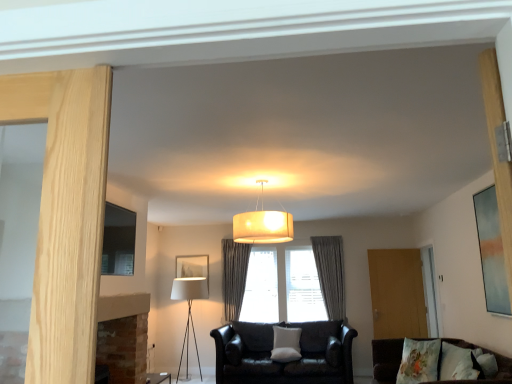
Question: Is white fabric pillow at center, the first pillow when ordered from bottom to top, facing towards gray fabric curtain at center, marked as the first curtain in a left-to-right arrangement?

Choices:
 (A) no
 (B) yes

Answer: (A)

Question: Is white fabric pillow at center, the first pillow when ordered from bottom to top, smaller than gray fabric curtain at center, marked as the first curtain in a left-to-right arrangement?

Choices:
 (A) no
 (B) yes

Answer: (B)

Question: From a real-world perspective, is white fabric pillow at center, the first pillow positioned from the left, over gray fabric curtain at center, which is counted as the 2th curtain, starting from the right?

Choices:
 (A) no
 (B) yes

Answer: (A)

Question: Is white fabric pillow at center, which appears as the 3th pillow when viewed from the right, shorter than gray fabric curtain at center, which is counted as the 2th curtain, starting from the right?

Choices:
 (A) no
 (B) yes

Answer: (B)

Question: Considering the relative positions of white fabric pillow at center, the 3th pillow in the top-to-bottom sequence, and gray fabric curtain at center, marked as the first curtain in a left-to-right arrangement, in the image provided, is white fabric pillow at center, the 3th pillow in the top-to-bottom sequence, to the left of gray fabric curtain at center, marked as the first curtain in a left-to-right arrangement, from the viewer's perspective?

Choices:
 (A) no
 (B) yes

Answer: (A)

Question: From the image's perspective, is white fabric pillow at center, the first pillow when ordered from back to front, beneath gray fabric curtain at center, which is counted as the 2th curtain, starting from the right?

Choices:
 (A) no
 (B) yes

Answer: (B)

Question: Is matte black picture frame at left, the first picture frame in the left-to-right sequence, surrounding velvet brown couch at lower right, the first studio couch viewed from the front?

Choices:
 (A) no
 (B) yes

Answer: (A)

Question: Is matte black picture frame at left, the first picture frame in the left-to-right sequence, oriented away from velvet brown couch at lower right, the first studio couch viewed from the front?

Choices:
 (A) yes
 (B) no

Answer: (B)

Question: Considering the relative sizes of matte black picture frame at left, arranged as the 2th picture frame when viewed from the back, and velvet brown couch at lower right, the first studio couch viewed from the front, in the image provided, is matte black picture frame at left, arranged as the 2th picture frame when viewed from the back, smaller than velvet brown couch at lower right, the first studio couch viewed from the front,?

Choices:
 (A) no
 (B) yes

Answer: (B)

Question: Is matte black picture frame at left, arranged as the 2th picture frame when viewed from the back, positioned far away from velvet brown couch at lower right, the first studio couch viewed from the front?

Choices:
 (A) yes
 (B) no

Answer: (A)

Question: Could you tell me if matte black picture frame at left, which is the second picture frame from front to back, is facing velvet brown couch at lower right, marked as the second studio couch in a back-to-front arrangement?

Choices:
 (A) yes
 (B) no

Answer: (A)

Question: Does matte black picture frame at left, which is the 3th picture frame from right to left, appear on the right side of velvet brown couch at lower right, the first studio couch viewed from the front?

Choices:
 (A) no
 (B) yes

Answer: (A)

Question: Does white fabric picture frame at center, which ranks as the 3th picture frame in front-to-back order, have a lesser width compared to fluffy cotton pillow at lower right, which ranks as the third pillow in left-to-right order?

Choices:
 (A) yes
 (B) no

Answer: (A)